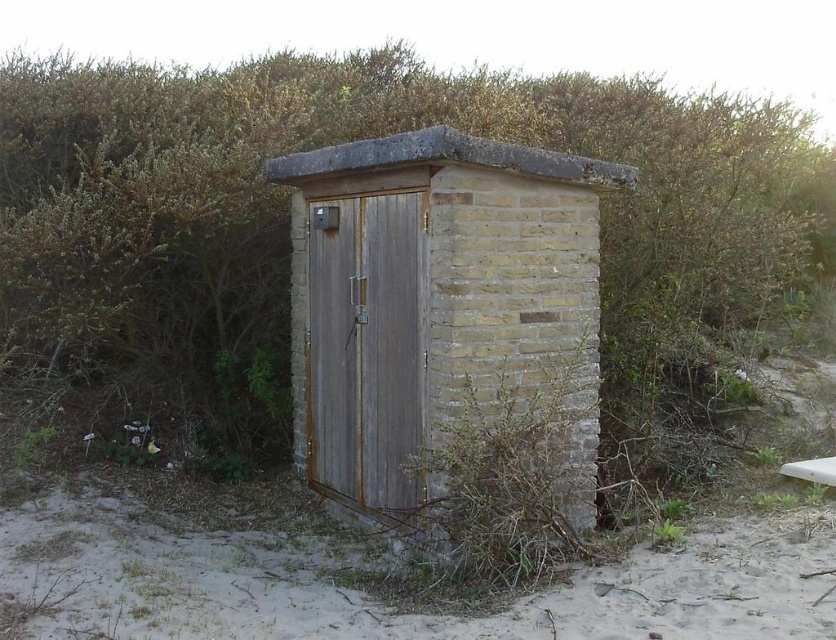
Is green leafy hedge at center further to the viewer compared to rusty wood hut at center?

Yes, it is behind rusty wood hut at center.

Between green leafy hedge at center and rusty wood hut at center, which one appears on the left side from the viewer's perspective?

Positioned to the left is green leafy hedge at center.

Which is in front, point (798, 234) or point (472, 342)?

Positioned in front is point (472, 342).

This screenshot has height=640, width=836. Find the location of `green leafy hedge at center`. green leafy hedge at center is located at coordinates (287, 220).